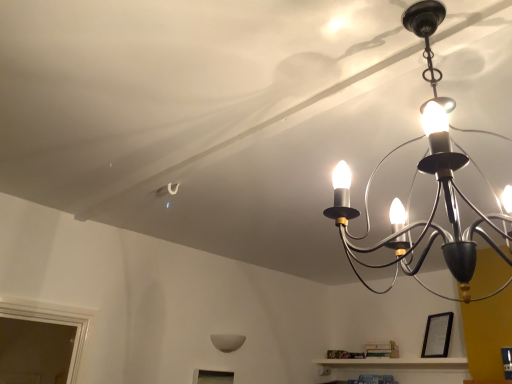
Question: Should I look upward or downward to see matte black chandelier at upper right, marked as the 1th lamp in a top-to-bottom arrangement?

Choices:
 (A) up
 (B) down

Answer: (A)

Question: Is white matte wall sconce at lower center, which is the second lamp from front to back, in contact with matte black chandelier at upper right, which is the second lamp from back to front?

Choices:
 (A) yes
 (B) no

Answer: (B)

Question: Does white matte wall sconce at lower center, which is the first lamp in left-to-right order, come behind matte black chandelier at upper right, the 2th lamp when ordered from left to right?

Choices:
 (A) yes
 (B) no

Answer: (A)

Question: From the image's perspective, is white matte wall sconce at lower center, which is the first lamp in left-to-right order, over matte black chandelier at upper right, marked as the 1th lamp in a top-to-bottom arrangement?

Choices:
 (A) yes
 (B) no

Answer: (B)

Question: Does white matte wall sconce at lower center, arranged as the first lamp when ordered from the bottom, have a larger size compared to matte black chandelier at upper right, marked as the 1th lamp in a top-to-bottom arrangement?

Choices:
 (A) yes
 (B) no

Answer: (B)

Question: From the image's perspective, does white matte wall sconce at lower center, which is the first lamp in left-to-right order, appear lower than matte black chandelier at upper right, which is the second lamp from back to front?

Choices:
 (A) no
 (B) yes

Answer: (B)

Question: Is white matte wall sconce at lower center, marked as the second lamp in a top-to-bottom arrangement, outside matte black chandelier at upper right, which ranks as the first lamp in right-to-left order?

Choices:
 (A) yes
 (B) no

Answer: (A)

Question: Does white matte wall sconce at lower center, marked as the second lamp in a top-to-bottom arrangement, touch black matte picture frame at lower right?

Choices:
 (A) yes
 (B) no

Answer: (B)

Question: Considering the relative sizes of white matte wall sconce at lower center, arranged as the first lamp when ordered from the bottom, and black matte picture frame at lower right in the image provided, is white matte wall sconce at lower center, arranged as the first lamp when ordered from the bottom, shorter than black matte picture frame at lower right?

Choices:
 (A) no
 (B) yes

Answer: (B)

Question: Can you confirm if white matte wall sconce at lower center, which appears as the 2th lamp when viewed from the right, is wider than black matte picture frame at lower right?

Choices:
 (A) yes
 (B) no

Answer: (B)

Question: From the image's perspective, is white matte wall sconce at lower center, arranged as the first lamp when ordered from the bottom, beneath black matte picture frame at lower right?

Choices:
 (A) no
 (B) yes

Answer: (B)

Question: Is white matte wall sconce at lower center, which is counted as the 1th lamp, starting from the back, behind black matte picture frame at lower right?

Choices:
 (A) yes
 (B) no

Answer: (A)

Question: Is white matte wall sconce at lower center, which is the second lamp from front to back, aimed at black matte picture frame at lower right?

Choices:
 (A) yes
 (B) no

Answer: (B)

Question: Is matte black chandelier at upper right, which is the second lamp from back to front, located outside white matte wall sconce at lower center, marked as the second lamp in a top-to-bottom arrangement?

Choices:
 (A) yes
 (B) no

Answer: (A)